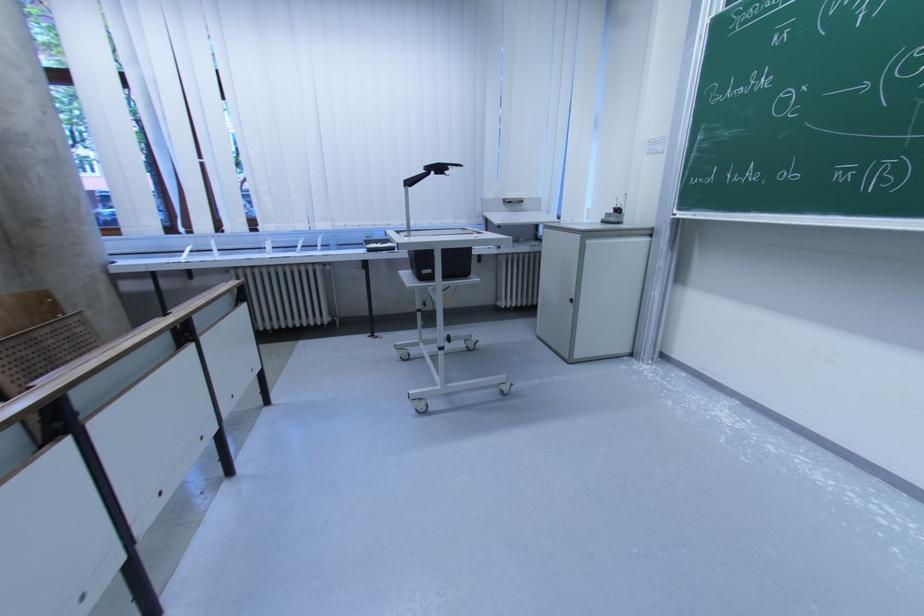
The width and height of the screenshot is (924, 616). What do you see at coordinates (440, 168) in the screenshot?
I see `a black projector head` at bounding box center [440, 168].